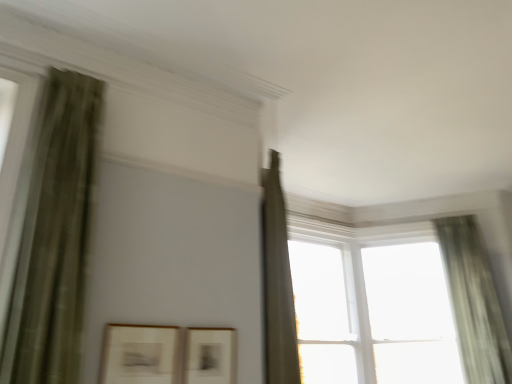
Question: Could you tell me if matte black picture frame at center, which ranks as the 1th picture frame in right-to-left order, is turned towards matte white picture frame at lower left, marked as the 1th picture frame in a left-to-right arrangement?

Choices:
 (A) yes
 (B) no

Answer: (B)

Question: Is matte black picture frame at center, the 2th picture frame when ordered from left to right, positioned with its back to matte white picture frame at lower left, marked as the 1th picture frame in a left-to-right arrangement?

Choices:
 (A) yes
 (B) no

Answer: (B)

Question: Does matte black picture frame at center, which ranks as the 1th picture frame in right-to-left order, come behind matte white picture frame at lower left, marked as the 1th picture frame in a left-to-right arrangement?

Choices:
 (A) yes
 (B) no

Answer: (A)

Question: From the image's perspective, is matte black picture frame at center, the 2th picture frame when ordered from left to right, under matte white picture frame at lower left, the 2th picture frame from the right?

Choices:
 (A) no
 (B) yes

Answer: (B)

Question: From the image's perspective, does matte black picture frame at center, the 2th picture frame when ordered from left to right, appear higher than matte white picture frame at lower left, marked as the 1th picture frame in a left-to-right arrangement?

Choices:
 (A) yes
 (B) no

Answer: (B)

Question: Is matte black picture frame at center, the 2th picture frame when ordered from left to right, taller than matte white picture frame at lower left, the 2th picture frame from the right?

Choices:
 (A) yes
 (B) no

Answer: (B)

Question: Is transparent glass window at upper right, the 3th window in the left-to-right sequence, at the right side of matte white picture frame at lower left, marked as the 1th picture frame in a left-to-right arrangement?

Choices:
 (A) no
 (B) yes

Answer: (B)

Question: Is transparent glass window at upper right, marked as the 1th window in a right-to-left arrangement, not inside matte white picture frame at lower left, the 2th picture frame from the right?

Choices:
 (A) no
 (B) yes

Answer: (B)

Question: Is transparent glass window at upper right, marked as the 1th window in a right-to-left arrangement, facing away from matte white picture frame at lower left, the 2th picture frame from the right?

Choices:
 (A) yes
 (B) no

Answer: (B)

Question: Does transparent glass window at upper right, the 3th window in the left-to-right sequence, lie behind matte white picture frame at lower left, marked as the 1th picture frame in a left-to-right arrangement?

Choices:
 (A) yes
 (B) no

Answer: (A)

Question: Is transparent glass window at upper right, marked as the 1th window in a right-to-left arrangement, oriented towards matte white picture frame at lower left, marked as the 1th picture frame in a left-to-right arrangement?

Choices:
 (A) yes
 (B) no

Answer: (A)

Question: Considering the relative sizes of transparent glass window at upper right, marked as the 1th window in a right-to-left arrangement, and matte white picture frame at lower left, the 2th picture frame from the right, in the image provided, is transparent glass window at upper right, marked as the 1th window in a right-to-left arrangement, shorter than matte white picture frame at lower left, the 2th picture frame from the right,?

Choices:
 (A) yes
 (B) no

Answer: (B)

Question: Can you confirm if green sheer curtain at right, which is the 1th curtain from right to left, is taller than transparent glass window at upper right, which is the second window from left to right?

Choices:
 (A) no
 (B) yes

Answer: (B)